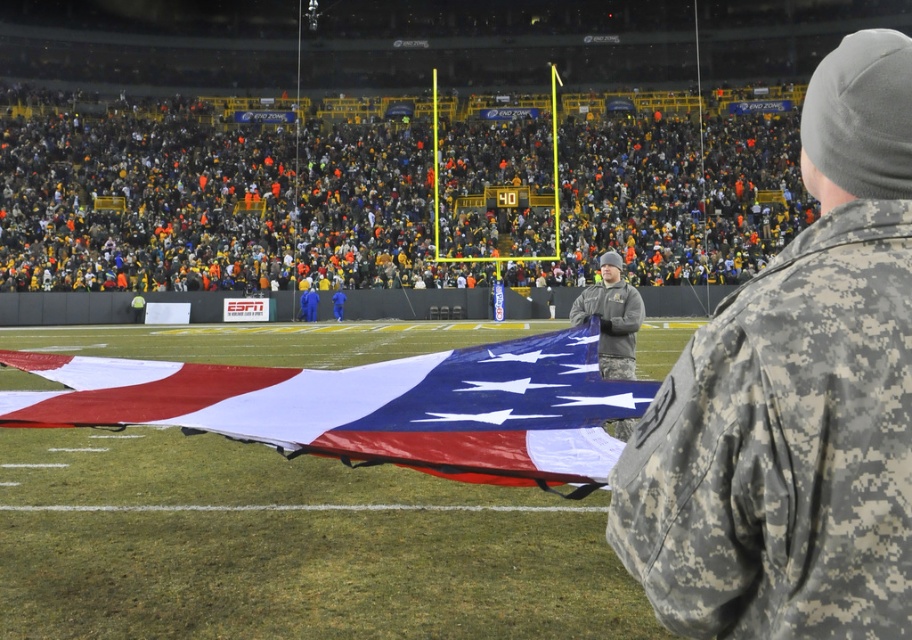
Question: Which of the following is the farthest from the observer?

Choices:
 (A) (628, 310)
 (B) (696, 556)

Answer: (A)

Question: Which point appears closest to the camera in this image?

Choices:
 (A) (319, 387)
 (B) (701, 340)
 (C) (622, 340)

Answer: (B)

Question: Which point is farther to the camera?

Choices:
 (A) (588, 300)
 (B) (81, 145)
 (C) (805, 269)
 (D) (426, 451)

Answer: (B)

Question: Is camouflage uniform at center to the left of camouflage fabric uniform at right from the viewer's perspective?

Choices:
 (A) no
 (B) yes

Answer: (B)

Question: Is camouflage fabric uniform at right to the right of camouflage fabric uniform at center from the viewer's perspective?

Choices:
 (A) no
 (B) yes

Answer: (A)

Question: Observing the image, what is the correct spatial positioning of camouflage uniform at center in reference to polyester american flag at center?

Choices:
 (A) above
 (B) below

Answer: (A)